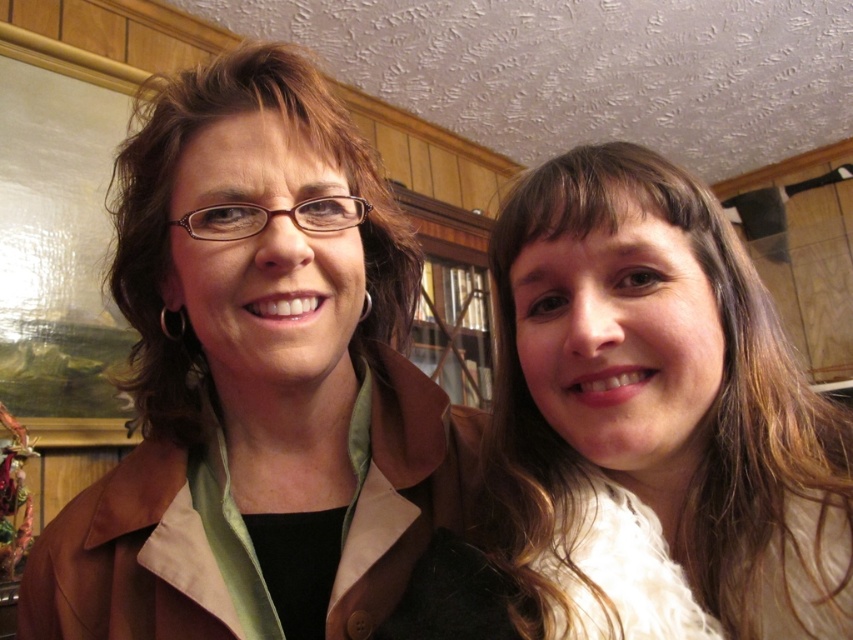
Is matte brown jacket at center to the right of smooth white blouse at right from the viewer's perspective?

No, matte brown jacket at center is not to the right of smooth white blouse at right.

Between matte brown jacket at center and smooth white blouse at right, which one is positioned lower?

smooth white blouse at right is below.

Locate an element on the screen. This screenshot has width=853, height=640. matte brown jacket at center is located at coordinates (260, 387).

Can you confirm if matte brown jacket at center is positioned above brown matte hair at center?

Incorrect, matte brown jacket at center is not positioned above brown matte hair at center.

Does matte brown jacket at center have a lesser width compared to brown matte hair at center?

Correct, matte brown jacket at center's width is less than brown matte hair at center's.

Does point (401, 358) come farther from viewer compared to point (175, 369)?

That is False.

Where is `matte brown jacket at center`? matte brown jacket at center is located at coordinates (260, 387).

Does smooth white blouse at right have a greater height compared to brown matte hair at center?

No, smooth white blouse at right is not taller than brown matte hair at center.

Can you confirm if smooth white blouse at right is positioned to the right of brown matte hair at center?

Indeed, smooth white blouse at right is positioned on the right side of brown matte hair at center.

Find the location of a particular element. Image resolution: width=853 pixels, height=640 pixels. smooth white blouse at right is located at coordinates (653, 420).